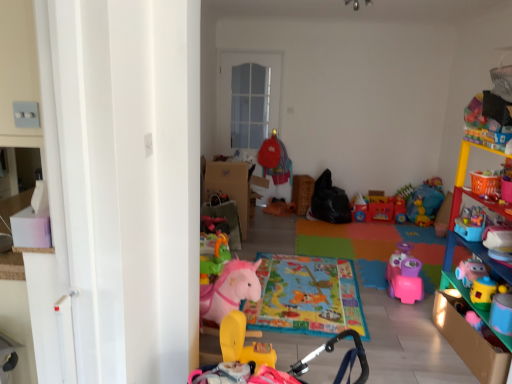
Question: Can you confirm if rubber yellow horse at center, acting as the first toy starting from the back, is smaller than rubber yellow rocking horse at lower center, the second toy from the back?

Choices:
 (A) yes
 (B) no

Answer: (A)

Question: Does rubber yellow horse at center, the 2th toy from the front, have a greater width compared to rubber yellow rocking horse at lower center, the 1th toy positioned from the front?

Choices:
 (A) yes
 (B) no

Answer: (B)

Question: Are rubber yellow horse at center, acting as the first toy starting from the back, and rubber yellow rocking horse at lower center, the second toy from the back, located far from each other?

Choices:
 (A) yes
 (B) no

Answer: (B)

Question: From a real-world perspective, is rubber yellow horse at center, acting as the first toy starting from the back, positioned under rubber yellow rocking horse at lower center, the second toy from the back, based on gravity?

Choices:
 (A) yes
 (B) no

Answer: (A)

Question: Is the position of rubber yellow horse at center, acting as the first toy starting from the back, less distant than that of rubber yellow rocking horse at lower center, the second toy from the back?

Choices:
 (A) no
 (B) yes

Answer: (A)

Question: Considering the positions of rubber yellow rocking horse at lower center, the 1th toy positioned from the front, and multicolored plastic shelf at right in the image, is rubber yellow rocking horse at lower center, the 1th toy positioned from the front, taller or shorter than multicolored plastic shelf at right?

Choices:
 (A) tall
 (B) short

Answer: (B)

Question: Is rubber yellow rocking horse at lower center, the second toy from the back, bigger or smaller than multicolored plastic shelf at right?

Choices:
 (A) small
 (B) big

Answer: (A)

Question: In terms of width, does rubber yellow rocking horse at lower center, the 1th toy positioned from the front, look wider or thinner when compared to multicolored plastic shelf at right?

Choices:
 (A) thin
 (B) wide

Answer: (B)

Question: Is point (237, 321) positioned closer to the camera than point (460, 145)?

Choices:
 (A) farther
 (B) closer

Answer: (B)

Question: Would you say rubber yellow horse at center, acting as the first toy starting from the back, is to the left or to the right of rubber yellow rocking horse at lower center, the 1th toy positioned from the front, in the picture?

Choices:
 (A) right
 (B) left

Answer: (B)

Question: Is rubber yellow horse at center, acting as the first toy starting from the back, wider or thinner than rubber yellow rocking horse at lower center, the second toy from the back?

Choices:
 (A) wide
 (B) thin

Answer: (B)

Question: From a real-world perspective, relative to rubber yellow rocking horse at lower center, the 1th toy positioned from the front, is rubber yellow horse at center, the 2th toy from the front, vertically above or below?

Choices:
 (A) below
 (B) above

Answer: (A)

Question: Relative to rubber yellow rocking horse at lower center, the 1th toy positioned from the front, is rubber yellow horse at center, acting as the first toy starting from the back, in front or behind?

Choices:
 (A) front
 (B) behind

Answer: (B)

Question: In the image, is rubber yellow rocking horse at lower center, the second toy from the back, positioned in front of or behind rubber yellow horse at center, acting as the first toy starting from the back?

Choices:
 (A) front
 (B) behind

Answer: (A)

Question: From a real-world perspective, relative to rubber yellow horse at center, the 2th toy from the front, is rubber yellow rocking horse at lower center, the 1th toy positioned from the front, vertically above or below?

Choices:
 (A) below
 (B) above

Answer: (B)